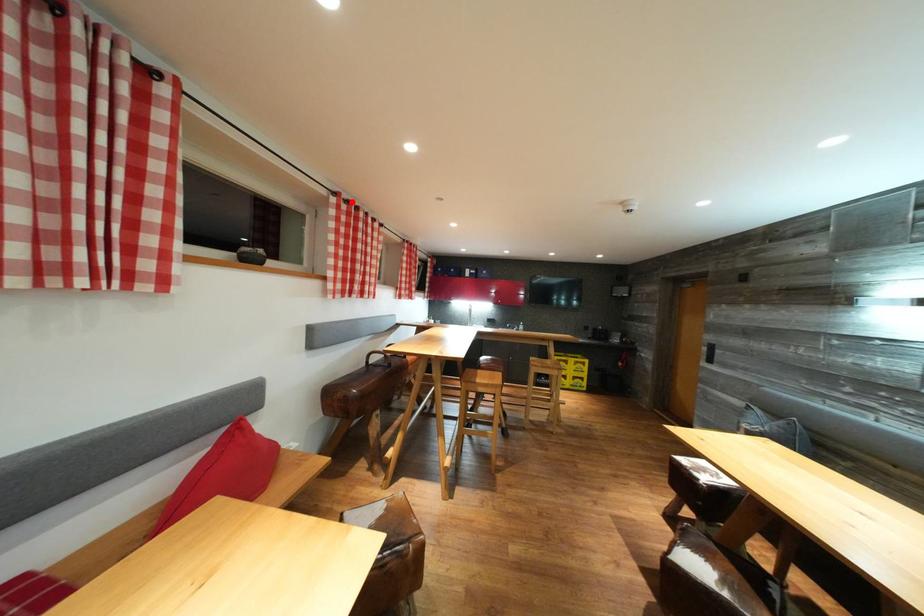
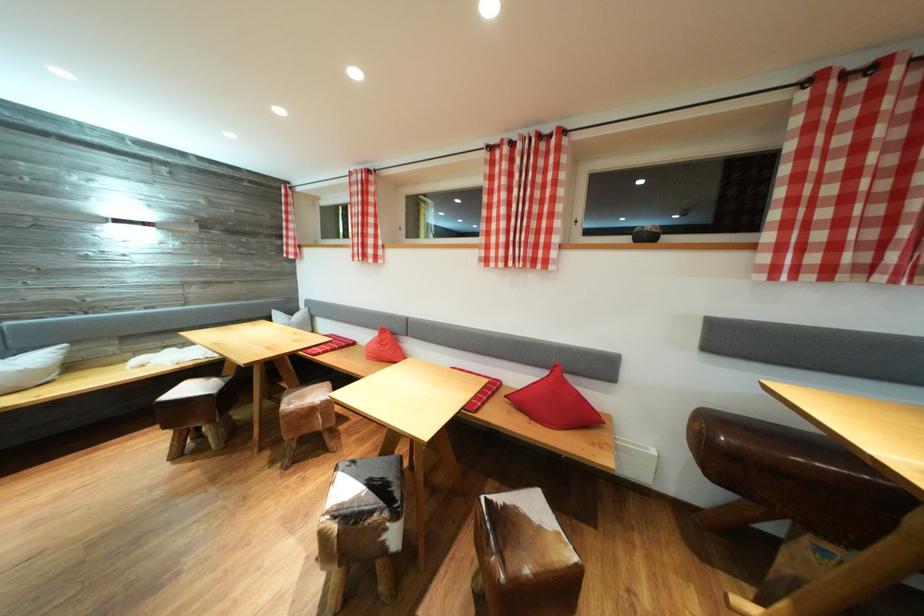
Where in the second image is the point corresponding to the highlighted location from the first image?

(869, 66)